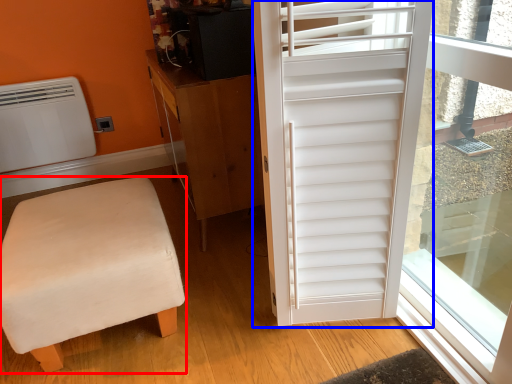
Question: Which of the following is the closest to the observer, furniture (highlighted by a red box) or door (highlighted by a blue box)?

Choices:
 (A) furniture
 (B) door

Answer: (B)